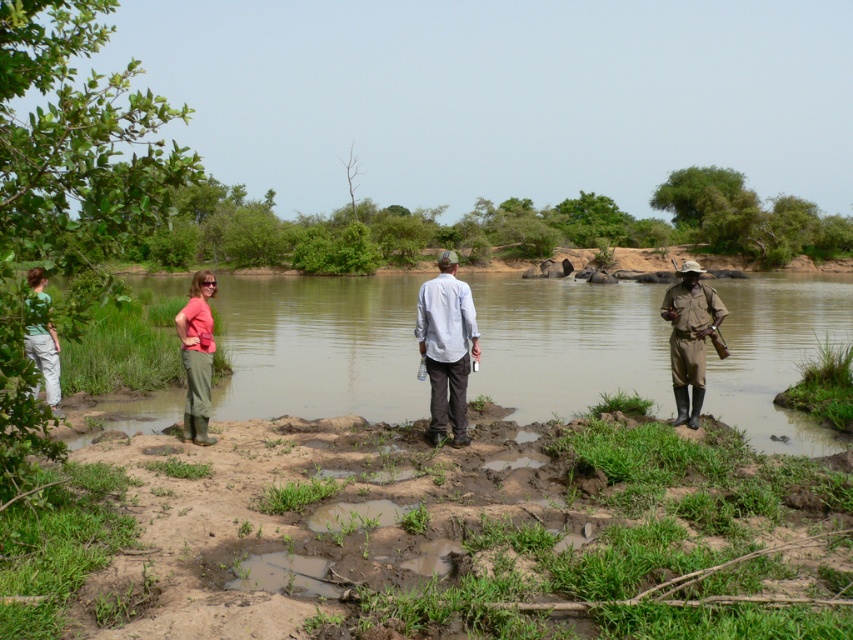
You are a hiker trying to locate two people in the middle of the scene. You see the light blue cotton shirt at center and the brown uniform at center. Which one is closer to you?

The light blue cotton shirt at center is closer to you because it is in front of the brown uniform at center.

You are navigating a drone over the riverbank scene. The drone must avoid obstacles and reach a specific point. Given the coordinates provided in the Objects Description, can the drone safely land at the location marked by the light blue cotton shirt at center without colliding with any nearby objects?

The light blue cotton shirt at center is located at point (445,346). Since there are no other objects mentioned in the Objects Description that could obstruct this landing zone, the drone can safely land there.